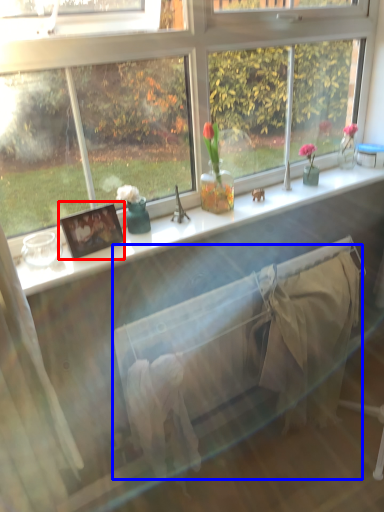
Question: Which object appears closest to the camera in this image, picture frame (highlighted by a red box) or bed frame (highlighted by a blue box)?

Choices:
 (A) picture frame
 (B) bed frame

Answer: (A)